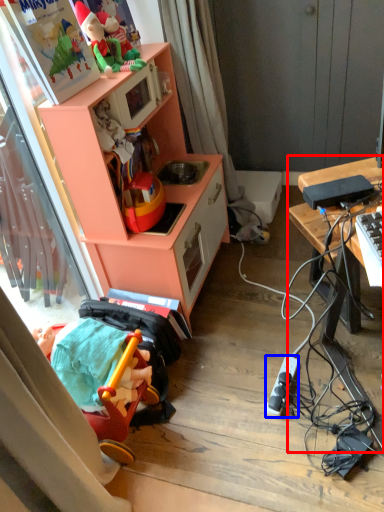
Question: Which of the following is the closest to the observer, desk (highlighted by a red box) or appliance (highlighted by a blue box)?

Choices:
 (A) desk
 (B) appliance

Answer: (A)